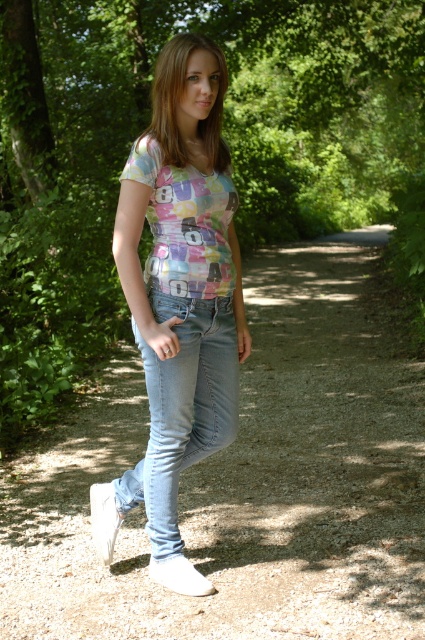
Question: Estimate the real-world distances between objects in this image. Which object is closer to the pastel printed t-shirt at center?

Choices:
 (A) white leather shoe at lower left
 (B) white suede shoe at lower center

Answer: (B)

Question: Is dirt path at center behind pastel printed t-shirt at center?

Choices:
 (A) no
 (B) yes

Answer: (A)

Question: Based on their relative distances, which object is farther from the white leather shoe at lower left?

Choices:
 (A) dirt path at center
 (B) light blue denim jeans at center

Answer: (A)

Question: Can you confirm if light blue denim jeans at center is wider than white leather shoe at lower left?

Choices:
 (A) yes
 (B) no

Answer: (A)

Question: Which point is farther to the camera?

Choices:
 (A) white suede shoe at lower center
 (B) pastel printed t-shirt at center

Answer: (A)

Question: Does light blue denim jeans at center have a smaller size compared to white suede shoe at lower center?

Choices:
 (A) yes
 (B) no

Answer: (B)